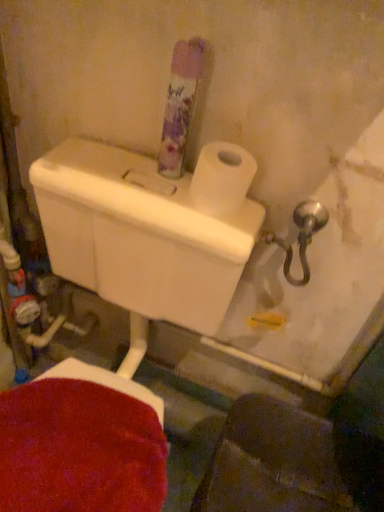
Image resolution: width=384 pixels, height=512 pixels. Describe the element at coordinates (221, 179) in the screenshot. I see `white matte toilet paper at upper right` at that location.

Identify the location of white matte toilet paper at upper right. The height and width of the screenshot is (512, 384). (221, 179).

Measure the distance between point (173, 166) and camera.

Point (173, 166) and camera are 30.51 inches apart.

Measure the distance between translucent floral-patterned air freshener at upper center and camera.

25.71 inches.

Describe the element at coordinates (180, 105) in the screenshot. The image size is (384, 512). I see `translucent floral-patterned air freshener at upper center` at that location.

Where is `translucent floral-patterned air freshener at upper center`? The image size is (384, 512). translucent floral-patterned air freshener at upper center is located at coordinates (180, 105).

Where is `white matte toilet paper at upper right`? This screenshot has height=512, width=384. white matte toilet paper at upper right is located at coordinates (221, 179).

Is white matte toilet paper at upper right to the left or to the right of translucent floral-patterned air freshener at upper center in the image?

→ From the image, it's evident that white matte toilet paper at upper right is to the right of translucent floral-patterned air freshener at upper center.

Which object is closer to the camera, white matte toilet paper at upper right or translucent floral-patterned air freshener at upper center?

translucent floral-patterned air freshener at upper center is more forward.

Which is closer, (237, 181) or (161, 158)?

The point (237, 181) is in front.

From the image's perspective, between white matte toilet paper at upper right and translucent floral-patterned air freshener at upper center, who is located below?

white matte toilet paper at upper right is shown below in the image.

From a real-world perspective, who is located lower, white matte toilet paper at upper right or translucent floral-patterned air freshener at upper center?

white matte toilet paper at upper right.

Considering the relative sizes of white matte toilet paper at upper right and translucent floral-patterned air freshener at upper center in the image provided, is white matte toilet paper at upper right thinner than translucent floral-patterned air freshener at upper center?

No.

Considering the sizes of white matte toilet paper at upper right and translucent floral-patterned air freshener at upper center in the image, is white matte toilet paper at upper right taller or shorter than translucent floral-patterned air freshener at upper center?

Considering their sizes, white matte toilet paper at upper right has less height than translucent floral-patterned air freshener at upper center.

In the scene shown: Considering the sizes of objects white matte toilet paper at upper right and translucent floral-patterned air freshener at upper center in the image provided, who is smaller, white matte toilet paper at upper right or translucent floral-patterned air freshener at upper center?

Smaller between the two is white matte toilet paper at upper right.

Is translucent floral-patterned air freshener at upper center inside white matte toilet paper at upper right?

No, translucent floral-patterned air freshener at upper center is not inside white matte toilet paper at upper right.

Are white matte toilet paper at upper right and translucent floral-patterned air freshener at upper center located far from each other?

white matte toilet paper at upper right is near translucent floral-patterned air freshener at upper center, not far away.

Is white matte toilet paper at upper right turned away from translucent floral-patterned air freshener at upper center?

No, white matte toilet paper at upper right is not facing the opposite direction of translucent floral-patterned air freshener at upper center.

This screenshot has width=384, height=512. I want to click on toiletry in front of the white matte toilet paper at upper right, so [x=180, y=105].

Between translucent floral-patterned air freshener at upper center and white matte toilet paper at upper right, which one appears on the right side from the viewer's perspective?

Positioned to the right is white matte toilet paper at upper right.

Considering the positions of objects translucent floral-patterned air freshener at upper center and white matte toilet paper at upper right in the image provided, who is behind, translucent floral-patterned air freshener at upper center or white matte toilet paper at upper right?

white matte toilet paper at upper right.

Which point is more distant from viewer, (175, 88) or (226, 190)?

The point (226, 190) is more distant.

From the image's perspective, is translucent floral-patterned air freshener at upper center under white matte toilet paper at upper right?

Actually, translucent floral-patterned air freshener at upper center appears above white matte toilet paper at upper right in the image.

From a real-world perspective, which is physically below, translucent floral-patterned air freshener at upper center or white matte toilet paper at upper right?

white matte toilet paper at upper right.

From the picture: Is translucent floral-patterned air freshener at upper center wider than white matte toilet paper at upper right?

In fact, translucent floral-patterned air freshener at upper center might be narrower than white matte toilet paper at upper right.

Can you confirm if translucent floral-patterned air freshener at upper center is shorter than white matte toilet paper at upper right?

Incorrect, the height of translucent floral-patterned air freshener at upper center does not fall short of that of white matte toilet paper at upper right.

From the picture: Who is smaller, translucent floral-patterned air freshener at upper center or white matte toilet paper at upper right?

With smaller size is white matte toilet paper at upper right.

Do you think translucent floral-patterned air freshener at upper center is within white matte toilet paper at upper right, or outside of it?

translucent floral-patterned air freshener at upper center is not inside white matte toilet paper at upper right, it's outside.

Are translucent floral-patterned air freshener at upper center and white matte toilet paper at upper right beside each other?

Yes.

Is translucent floral-patterned air freshener at upper center facing towards white matte toilet paper at upper right?

No, translucent floral-patterned air freshener at upper center is not facing towards white matte toilet paper at upper right.

What's the angular difference between translucent floral-patterned air freshener at upper center and white matte toilet paper at upper right's facing directions?

translucent floral-patterned air freshener at upper center and white matte toilet paper at upper right are facing 0.000316 degrees away from each other.

Find the location of a particular element. toilet paper behind the translucent floral-patterned air freshener at upper center is located at coordinates (221, 179).

Locate an element on the screen. Image resolution: width=384 pixels, height=512 pixels. toiletry in front of the white matte toilet paper at upper right is located at coordinates (180, 105).

Where is `toilet paper located below the translucent floral-patterned air freshener at upper center (from the image's perspective)`? This screenshot has height=512, width=384. toilet paper located below the translucent floral-patterned air freshener at upper center (from the image's perspective) is located at coordinates (221, 179).